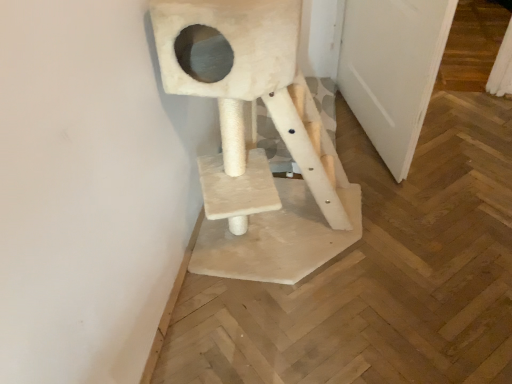
Identify the location of free point to the right of sanded wood cat tree at center. (423, 235).